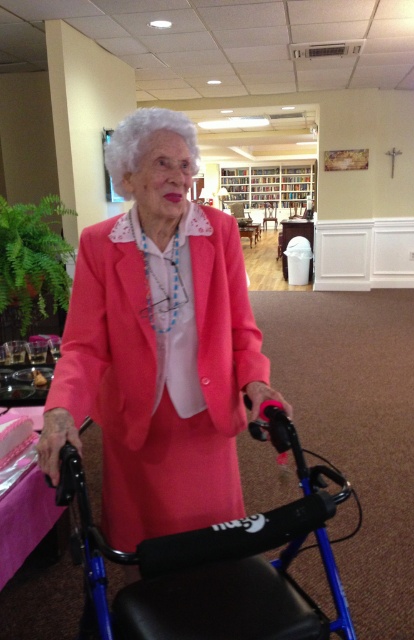
Can you confirm if blue plastic walker at center is positioned to the right of wooden bookshelf at upper center?

No, blue plastic walker at center is not to the right of wooden bookshelf at upper center.

Which of these two, blue plastic walker at center or wooden bookshelf at upper center, stands taller?

With more height is wooden bookshelf at upper center.

Find the location of a particular element. This screenshot has height=640, width=414. blue plastic walker at center is located at coordinates (216, 563).

Can you confirm if pink matte jacket at center is positioned to the left of wooden bookshelf at upper center?

Indeed, pink matte jacket at center is positioned on the left side of wooden bookshelf at upper center.

Does pink matte jacket at center have a larger size compared to wooden bookshelf at upper center?

No, pink matte jacket at center is not bigger than wooden bookshelf at upper center.

Identify the location of pink matte jacket at center. The image size is (414, 640). (158, 344).

In the scene shown: Is pink matte jacket at center to the left of blue plastic walker at center from the viewer's perspective?

Yes, pink matte jacket at center is to the left of blue plastic walker at center.

Between point (48, 472) and point (129, 595), which one is positioned behind?

Point (129, 595)

Locate an element on the screen. pink matte jacket at center is located at coordinates (158, 344).